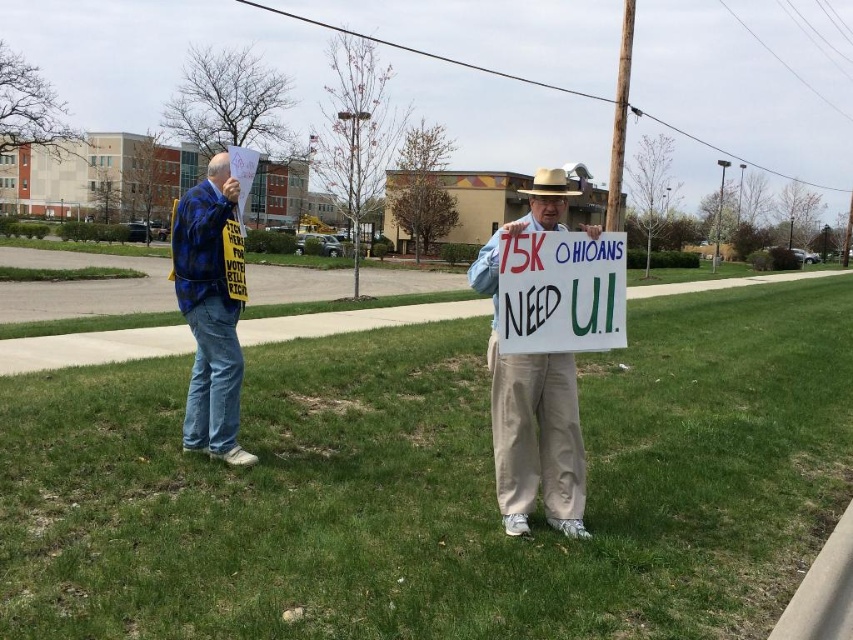
Does white paper sign at center have a smaller size compared to white cardboard sign at center?

No, white paper sign at center is not smaller than white cardboard sign at center.

Between white paper sign at center and white cardboard sign at center, which one has more height?

Standing taller between the two is white paper sign at center.

The width and height of the screenshot is (853, 640). In order to click on white paper sign at center in this screenshot , I will do `click(532, 404)`.

Between white paper sign at center and brown felt cowboy hat at center, which one is positioned higher?

brown felt cowboy hat at center is higher up.

From the picture: Does white paper sign at center have a lesser height compared to brown felt cowboy hat at center?

Yes, white paper sign at center is shorter than brown felt cowboy hat at center.

What do you see at coordinates (532, 404) in the screenshot?
I see `white paper sign at center` at bounding box center [532, 404].

Locate an element on the screen. This screenshot has height=640, width=853. white paper sign at center is located at coordinates (532, 404).

Is blue denim jeans at left below white cardboard sign at center?

Correct, blue denim jeans at left is located below white cardboard sign at center.

Locate an element on the screen. blue denim jeans at left is located at coordinates (212, 308).

The image size is (853, 640). What do you see at coordinates (212, 308) in the screenshot? I see `blue denim jeans at left` at bounding box center [212, 308].

You are a GUI agent. You are given a task and a screenshot of the screen. Output one action in this format:
    pyautogui.click(x=<x>, y=<y>)
    Task: Click on the blue denim jeans at left
    This screenshot has width=853, height=640.
    Given the screenshot: What is the action you would take?
    pyautogui.click(x=212, y=308)